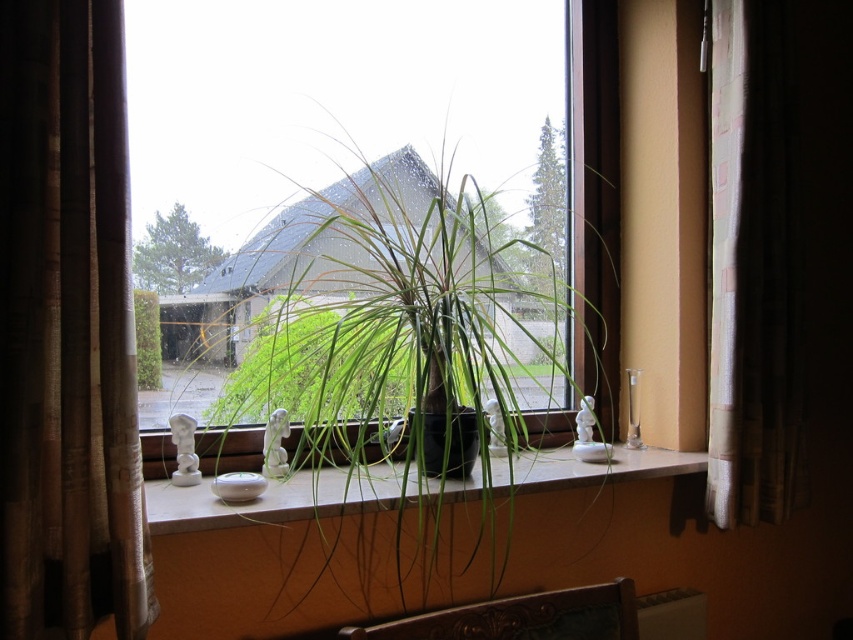
Question: From the image, what is the correct spatial relationship of brown textured curtain at left in relation to brown textured curtain at right?

Choices:
 (A) below
 (B) above

Answer: (A)

Question: Does brown textured curtain at left lie behind green matte plant at center?

Choices:
 (A) yes
 (B) no

Answer: (B)

Question: Which object is the farthest from the brown textured curtain at right?

Choices:
 (A) brown textured curtain at left
 (B) transparent glass window at center
 (C) green leafy plant at center

Answer: (C)

Question: Which object is closer to the camera taking this photo?

Choices:
 (A) brown textured curtain at left
 (B) transparent glass window at center
 (C) brown textured curtain at right

Answer: (A)

Question: Which object is the closest to the transparent glass window at center?

Choices:
 (A) brown textured curtain at right
 (B) brown textured curtain at left
 (C) green matte plant at center
 (D) green leafy plant at center

Answer: (C)

Question: Can you confirm if brown textured curtain at left is positioned to the left of green matte plant at center?

Choices:
 (A) yes
 (B) no

Answer: (A)